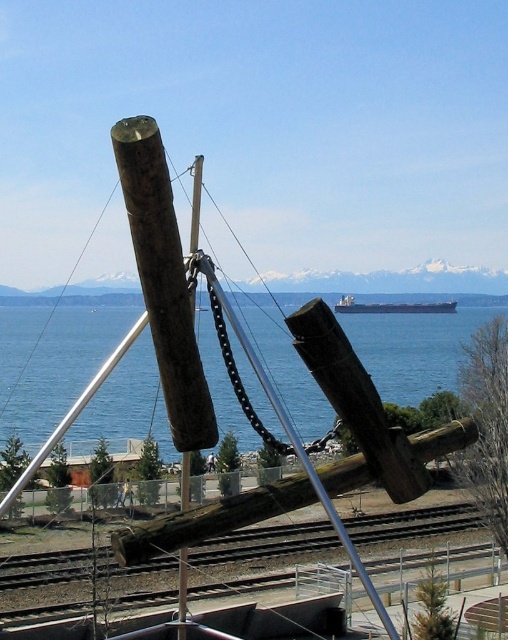
Question: Is brown wooden train track at lower center wider than metallic gray ship at center?

Choices:
 (A) no
 (B) yes

Answer: (B)

Question: Which of these objects is positioned farthest from the metallic gray ship at center?

Choices:
 (A) brown wooden train track at lower center
 (B) blue water at center

Answer: (A)

Question: Which object is closer to the camera taking this photo?

Choices:
 (A) metallic gray ship at center
 (B) blue water at center

Answer: (B)

Question: Can you confirm if brown wooden train track at lower center is positioned below wooden log at center?

Choices:
 (A) yes
 (B) no

Answer: (A)

Question: Is wooden log at center to the right of metallic gray ship at center from the viewer's perspective?

Choices:
 (A) no
 (B) yes

Answer: (A)

Question: Which object is the closest to the blue water at center?

Choices:
 (A) brown wooden train track at lower center
 (B) metallic gray ship at center
 (C) wooden log at center

Answer: (B)